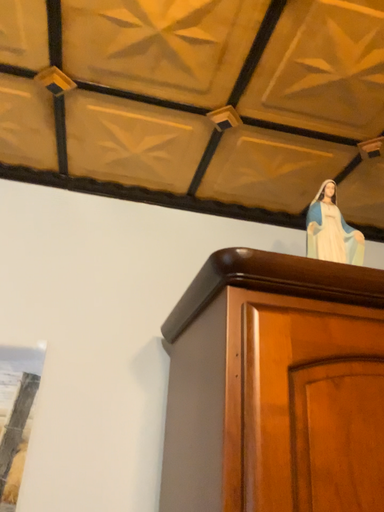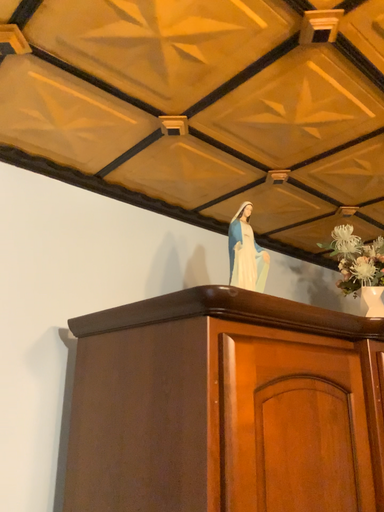
Question: How did the camera likely rotate when shooting the video?

Choices:
 (A) rotated left
 (B) rotated right

Answer: (B)